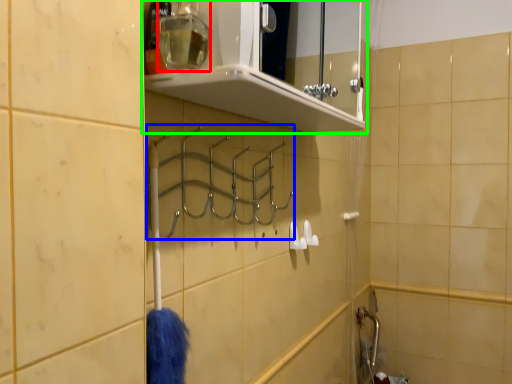
Question: Estimate the real-world distances between objects in this image. Which object is farther from toiletry (highlighted by a red box), hanger (highlighted by a blue box) or shelf (highlighted by a green box)?

Choices:
 (A) hanger
 (B) shelf

Answer: (B)